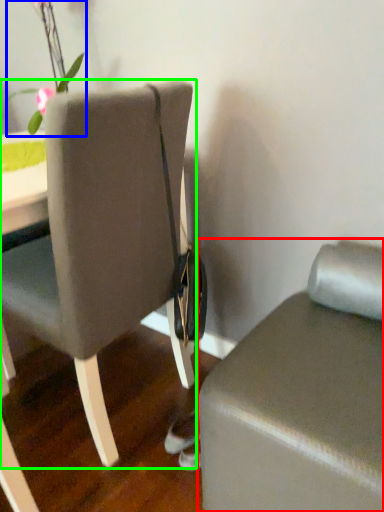
Question: Which is nearer to the furniture (highlighted by a red box)? floral arrangement (highlighted by a blue box) or chair (highlighted by a green box).

Choices:
 (A) floral arrangement
 (B) chair

Answer: (B)